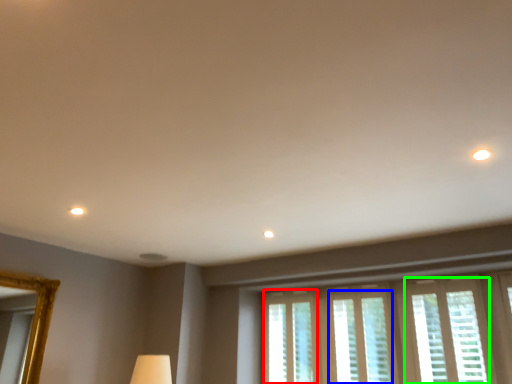
Question: Based on their relative distances, which object is farther from window (highlighted by a red box)? Choose from window (highlighted by a blue box) and window (highlighted by a green box).

Choices:
 (A) window
 (B) window

Answer: (B)